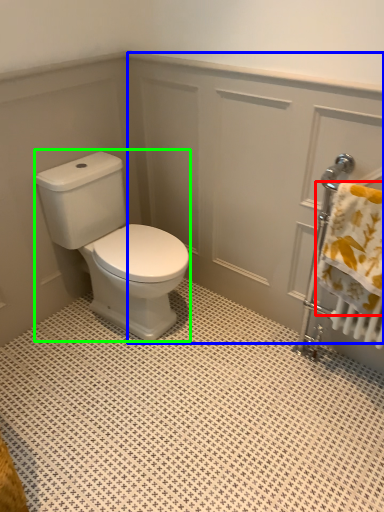
Question: Which is nearer to the bath towel (highlighted by a red box)? screen door (highlighted by a blue box) or porcelain (highlighted by a green box).

Choices:
 (A) screen door
 (B) porcelain

Answer: (A)